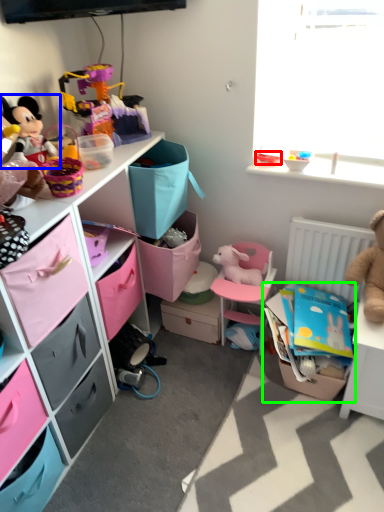
Question: Based on their relative distances, which object is farther from toy (highlighted by a red box)? Choose from toy (highlighted by a blue box) and storage box (highlighted by a green box).

Choices:
 (A) toy
 (B) storage box

Answer: (A)